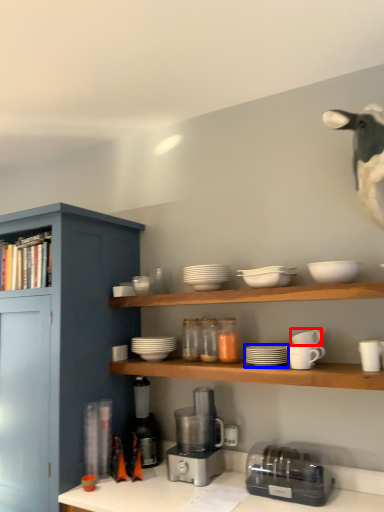
Question: Which of the following is the closest to the observer, tableware (highlighted by a red box) or tableware (highlighted by a blue box)?

Choices:
 (A) tableware
 (B) tableware

Answer: (B)